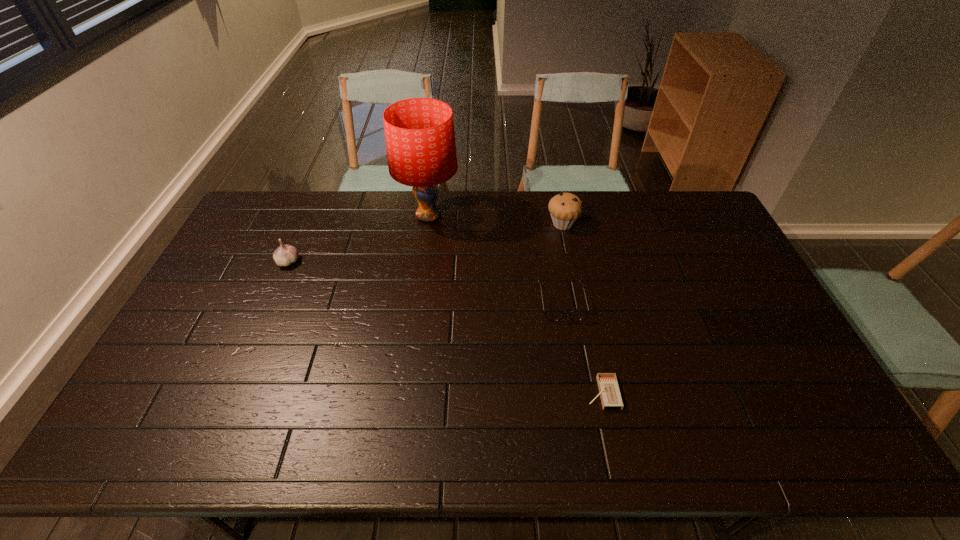
The height and width of the screenshot is (540, 960). I want to click on free region located on the right of the muffin, so click(601, 224).

I want to click on vacant position located on the back of the third farthest object, so tap(310, 212).

Locate an element on the screen. free space located 0.090m through the lenses of the second shortest object is located at coordinates (569, 347).

At what (x,y) coordinates should I click in order to perform the action: click on free spot located 0.260m on the striking surface of the shortest object. Please return your answer as a coordinate pair (x, y). Image resolution: width=960 pixels, height=540 pixels. Looking at the image, I should click on (485, 393).

Locate an element on the screen. vacant space positioned on the striking surface of the shortest object is located at coordinates (552, 393).

Image resolution: width=960 pixels, height=540 pixels. Identify the location of free space located on the striking surface of the shortest object. (509, 393).

You are a GUI agent. You are given a task and a screenshot of the screen. Output one action in this format:
    pyautogui.click(x=<x>, y=<y>)
    Task: Click on the lampshade at the far edge
    The width and height of the screenshot is (960, 540).
    Given the screenshot: What is the action you would take?
    pyautogui.click(x=420, y=140)

Identify the location of muffin situated at the far edge. (565, 208).

Where is `free region at the far edge of the desktop`? The width and height of the screenshot is (960, 540). free region at the far edge of the desktop is located at coordinates (547, 220).

In the image, there is a desktop. Find the location of `blank space at the near edge`. blank space at the near edge is located at coordinates (684, 421).